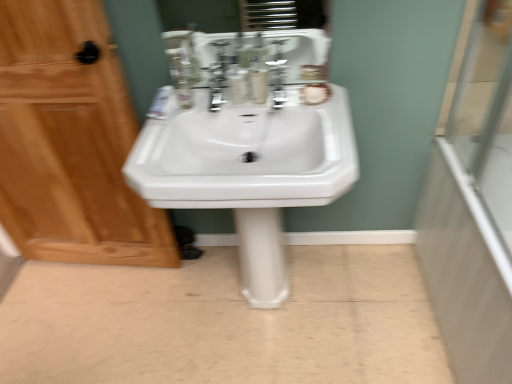
Question: Does transparent glass door at right appear on the right side of white glossy pedestal sink at center?

Choices:
 (A) no
 (B) yes

Answer: (B)

Question: Is transparent glass door at right closer to camera compared to white glossy pedestal sink at center?

Choices:
 (A) no
 (B) yes

Answer: (B)

Question: From a real-world perspective, does transparent glass door at right stand above white glossy pedestal sink at center?

Choices:
 (A) yes
 (B) no

Answer: (A)

Question: From the image's perspective, is transparent glass door at right located above white glossy pedestal sink at center?

Choices:
 (A) yes
 (B) no

Answer: (A)

Question: Would you consider transparent glass door at right to be distant from white glossy pedestal sink at center?

Choices:
 (A) yes
 (B) no

Answer: (B)

Question: Looking at their shapes, would you say translucent plastic mouthwash at center, positioned as the first mouthwash in left-to-right order, is wider or thinner than translucent plastic mouthwash at center, which is the 1th mouthwash from right to left?

Choices:
 (A) thin
 (B) wide

Answer: (B)

Question: Considering their positions, is translucent plastic mouthwash at center, positioned as the first mouthwash in left-to-right order, located in front of or behind translucent plastic mouthwash at center, which is the 1th mouthwash from right to left?

Choices:
 (A) behind
 (B) front

Answer: (A)

Question: From the image's perspective, relative to translucent plastic mouthwash at center, which is the 1th mouthwash from right to left, is translucent plastic mouthwash at center, positioned as the first mouthwash in left-to-right order, above or below?

Choices:
 (A) below
 (B) above

Answer: (A)

Question: Visually, is translucent plastic mouthwash at center, marked as the 2th mouthwash in a right-to-left arrangement, positioned to the left or to the right of translucent plastic mouthwash at center, marked as the 2th mouthwash in a left-to-right arrangement?

Choices:
 (A) left
 (B) right

Answer: (A)

Question: Considering their positions, is transparent glass door at right located in front of or behind translucent plastic mouthwash at center, marked as the 2th mouthwash in a right-to-left arrangement?

Choices:
 (A) front
 (B) behind

Answer: (A)

Question: Based on their sizes in the image, would you say transparent glass door at right is bigger or smaller than translucent plastic mouthwash at center, marked as the 2th mouthwash in a right-to-left arrangement?

Choices:
 (A) small
 (B) big

Answer: (B)

Question: In terms of height, does transparent glass door at right look taller or shorter compared to translucent plastic mouthwash at center, marked as the 2th mouthwash in a right-to-left arrangement?

Choices:
 (A) tall
 (B) short

Answer: (A)

Question: Considering the positions of point (492, 135) and point (237, 97), is point (492, 135) closer or farther from the camera than point (237, 97)?

Choices:
 (A) farther
 (B) closer

Answer: (A)

Question: Is transparent glass shower door at right spatially inside satin nickel faucet at upper center, or outside of it?

Choices:
 (A) inside
 (B) outside

Answer: (B)

Question: In terms of width, does transparent glass shower door at right look wider or thinner when compared to satin nickel faucet at upper center?

Choices:
 (A) wide
 (B) thin

Answer: (B)